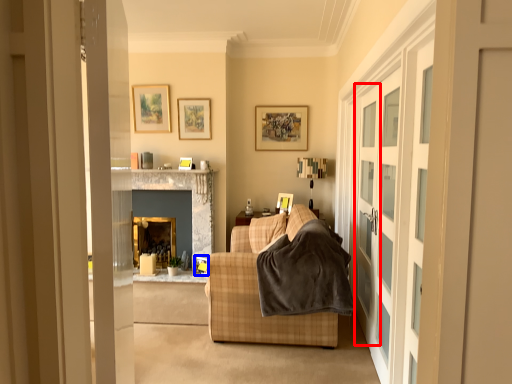
Question: Among these objects, which one is nearest to the camera, screen door (highlighted by a red box) or picture frame (highlighted by a blue box)?

Choices:
 (A) screen door
 (B) picture frame

Answer: (A)